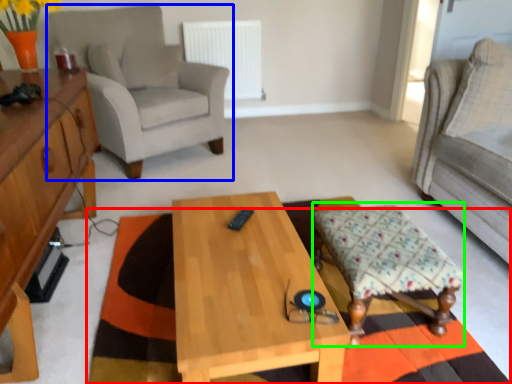
Question: Which object is positioned farthest from mat (highlighted by a red box)? Select from chair (highlighted by a blue box) and stool (highlighted by a green box).

Choices:
 (A) chair
 (B) stool

Answer: (A)